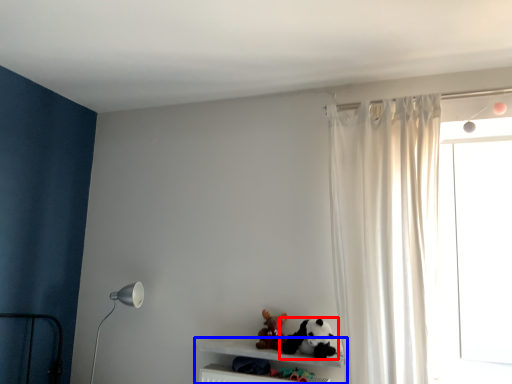
Question: Which point is further to the camera, toy (highlighted by a red box) or shelf (highlighted by a blue box)?

Choices:
 (A) toy
 (B) shelf

Answer: (A)